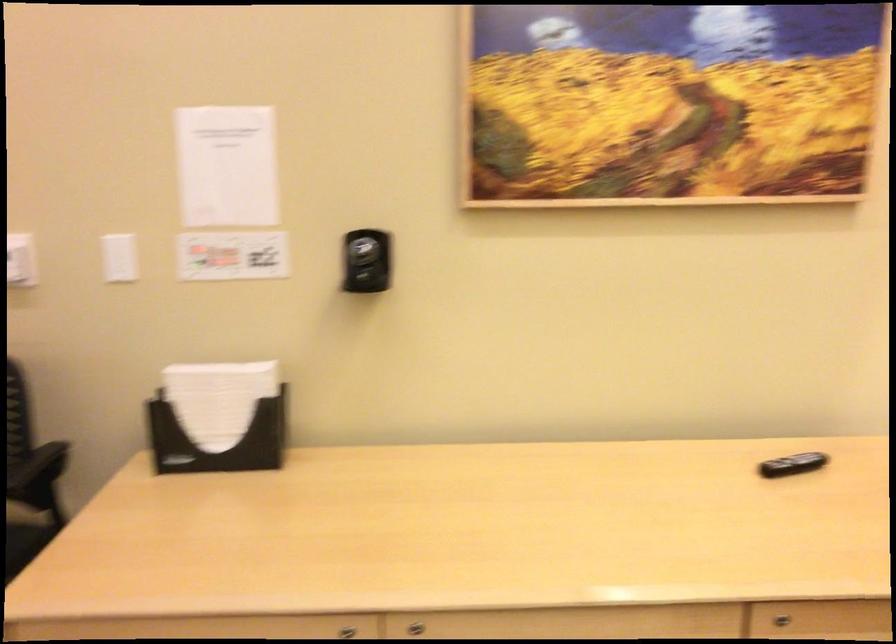
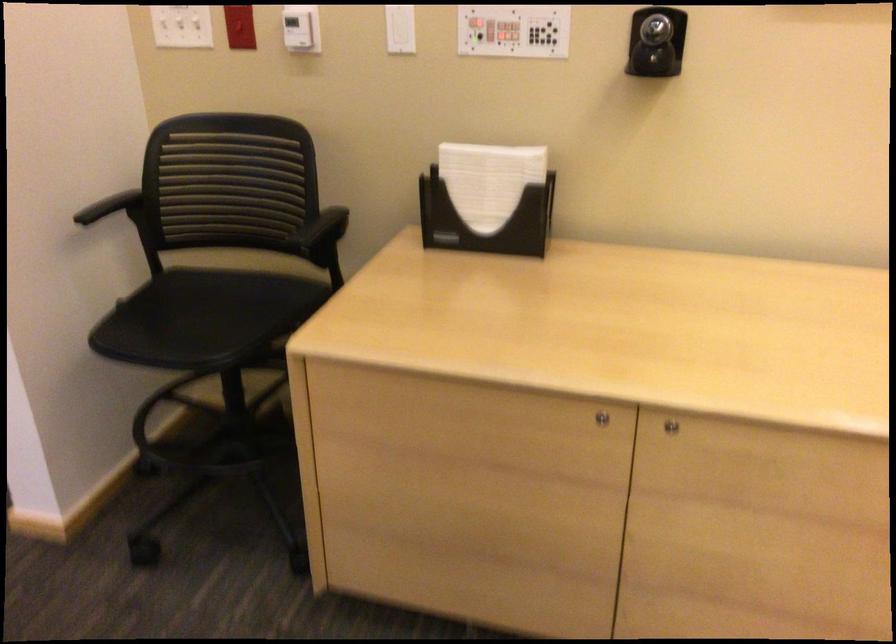
Find the pixel in the second image that matches point 231,251 in the first image.

(513, 31)